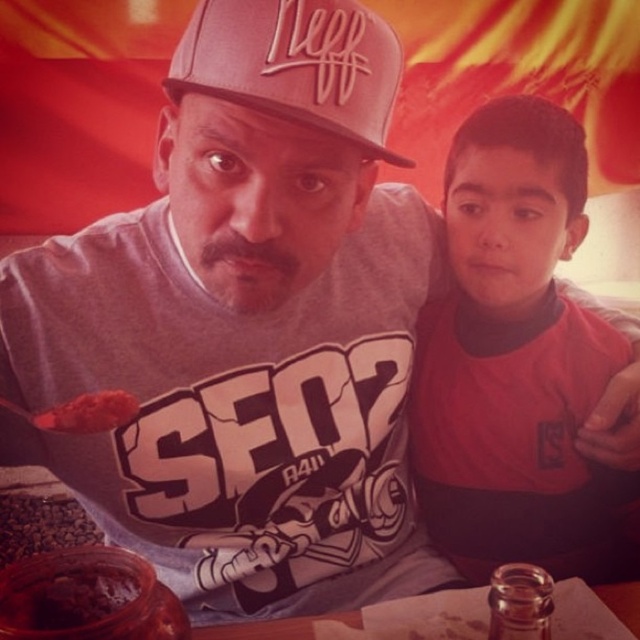
Is matte pink baseball cap at center above smooth tomato sauce at center?

Indeed, matte pink baseball cap at center is positioned over smooth tomato sauce at center.

Looking at this image, does matte pink baseball cap at center appear under smooth tomato sauce at center?

No, matte pink baseball cap at center is not below smooth tomato sauce at center.

At what (x,y) coordinates should I click in order to perform the action: click on matte pink baseball cap at center. Please return your answer as a coordinate pair (x, y). Looking at the image, I should click on point(296,65).

Can you confirm if matte pink baseball cap at center is thinner than brown matte coffee beans at lower left?

Yes, matte pink baseball cap at center is thinner than brown matte coffee beans at lower left.

Where is `matte pink baseball cap at center`? The width and height of the screenshot is (640, 640). matte pink baseball cap at center is located at coordinates (296, 65).

Is point (387, 156) in front of point (3, 525)?

That is True.

At what (x,y) coordinates should I click in order to perform the action: click on matte pink baseball cap at center. Please return your answer as a coordinate pair (x, y). Image resolution: width=640 pixels, height=640 pixels. Looking at the image, I should click on (296, 65).

Can you confirm if matte red shirt at center is bigger than smooth tomato sauce at center?

Yes.

Who is positioned more to the left, matte red shirt at center or smooth tomato sauce at center?

smooth tomato sauce at center is more to the left.

What do you see at coordinates (516, 362) in the screenshot? I see `matte red shirt at center` at bounding box center [516, 362].

The width and height of the screenshot is (640, 640). Find the location of `matte red shirt at center`. matte red shirt at center is located at coordinates (516, 362).